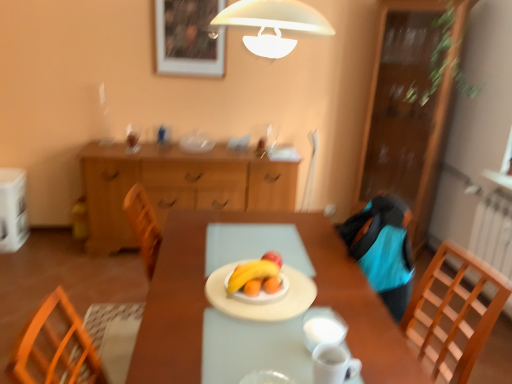
Image resolution: width=512 pixels, height=384 pixels. Identify the location of wooden cabinet at right, acting as the 2th cabinetry starting from the left. (413, 104).

Describe the element at coordinates (273, 257) in the screenshot. The height and width of the screenshot is (384, 512). I see `shiny red apple at center` at that location.

What do you see at coordinates (266, 378) in the screenshot? I see `white glossy cup at center, the 4th tableware viewed from the back` at bounding box center [266, 378].

You are a GUI agent. You are given a task and a screenshot of the screen. Output one action in this format:
    pyautogui.click(x=<x>, y=<y>)
    Task: Click on the white glossy cup at center, the 4th tableware viewed from the back
    
    Given the screenshot: What is the action you would take?
    pyautogui.click(x=266, y=378)

The width and height of the screenshot is (512, 384). Find the location of `white fabric armchair at upper center`. white fabric armchair at upper center is located at coordinates click(310, 173).

I want to click on light wood cabinet at center, marked as the first cabinetry in a left-to-right arrangement, so click(177, 186).

Where is `wooden table at center`? This screenshot has height=384, width=512. wooden table at center is located at coordinates (208, 303).

Find the location of a particular element. white glossy mug at center, which ranks as the 3th tableware in front-to-back order is located at coordinates (323, 331).

Which of these two, white fabric armchair at upper center or wooden picture frame at upper center, is bigger?

wooden picture frame at upper center.

From the picture: Does white fabric armchair at upper center turn towards wooden picture frame at upper center?

No, white fabric armchair at upper center is not facing towards wooden picture frame at upper center.

Looking at this image, is white fabric armchair at upper center positioned far away from wooden picture frame at upper center?

Indeed, white fabric armchair at upper center is not near wooden picture frame at upper center.

Is white fabric armchair at upper center completely or partially outside of wooden picture frame at upper center?

Yes, white fabric armchair at upper center is located beyond the bounds of wooden picture frame at upper center.

How distant is wooden table at center from wooden picture frame at upper center?

6.16 feet.

Between wooden table at center and wooden picture frame at upper center, which one appears on the left side from the viewer's perspective?

wooden picture frame at upper center is more to the left.

Is wooden table at center wider or thinner than wooden picture frame at upper center?

Clearly, wooden table at center has more width compared to wooden picture frame at upper center.

Is point (318, 226) farther from camera compared to point (169, 40)?

No.

From the picture: Which is more to the left, light wood cabinet at center, which is the second cabinetry from right to left, or white matte plate at center, positioned as the 1th tableware in back-to-front order?

light wood cabinet at center, which is the second cabinetry from right to left.

Does light wood cabinet at center, marked as the first cabinetry in a left-to-right arrangement, have a greater width compared to white matte plate at center, which is the fourth tableware in front-to-back order?

Yes.

From the picture: What's the angular difference between light wood cabinet at center, marked as the first cabinetry in a left-to-right arrangement, and white matte plate at center, which is the fourth tableware in front-to-back order,'s facing directions?

90.8 degrees separate the facing orientations of light wood cabinet at center, marked as the first cabinetry in a left-to-right arrangement, and white matte plate at center, which is the fourth tableware in front-to-back order.

Is there a large distance between light wood cabinet at center, which is the second cabinetry from right to left, and white matte plate at center, which is the fourth tableware in front-to-back order?

That's right, there is a large distance between light wood cabinet at center, which is the second cabinetry from right to left, and white matte plate at center, which is the fourth tableware in front-to-back order.

From a real-world perspective, is white glossy cup at center, which is counted as the first tableware, starting from the front, physically below white matte plate at center, positioned as the 1th tableware in back-to-front order?

Incorrect, from a real-world perspective, white glossy cup at center, which is counted as the first tableware, starting from the front, is higher than white matte plate at center, positioned as the 1th tableware in back-to-front order.

Can you confirm if white glossy cup at center, the 4th tableware viewed from the back, is taller than white matte plate at center, positioned as the 1th tableware in back-to-front order?

Yes, white glossy cup at center, the 4th tableware viewed from the back, is taller than white matte plate at center, positioned as the 1th tableware in back-to-front order.

Between white glossy cup at center, the 4th tableware viewed from the back, and white matte plate at center, which is the fourth tableware in front-to-back order, which one appears on the right side from the viewer's perspective?

Positioned to the right is white glossy cup at center, the 4th tableware viewed from the back.

Is there a large distance between white glossy cup at center, the 4th tableware viewed from the back, and white matte plate at center, positioned as the 1th tableware in back-to-front order?

Actually, white glossy cup at center, the 4th tableware viewed from the back, and white matte plate at center, positioned as the 1th tableware in back-to-front order, are a little close together.

Considering the sizes of objects light wood cabinet at center, which is the second cabinetry from right to left, and wooden picture frame at upper center in the image provided, who is taller, light wood cabinet at center, which is the second cabinetry from right to left, or wooden picture frame at upper center?

light wood cabinet at center, which is the second cabinetry from right to left, is taller.

Considering the relative positions of light wood cabinet at center, which is the second cabinetry from right to left, and wooden picture frame at upper center in the image provided, is light wood cabinet at center, which is the second cabinetry from right to left, to the left of wooden picture frame at upper center from the viewer's perspective?

Correct, you'll find light wood cabinet at center, which is the second cabinetry from right to left, to the left of wooden picture frame at upper center.

Is wooden picture frame at upper center at the back of light wood cabinet at center, marked as the first cabinetry in a left-to-right arrangement?

No, wooden picture frame at upper center is not at the back of light wood cabinet at center, marked as the first cabinetry in a left-to-right arrangement.

How much distance is there between light wood cabinet at center, marked as the first cabinetry in a left-to-right arrangement, and wooden picture frame at upper center?

The distance of light wood cabinet at center, marked as the first cabinetry in a left-to-right arrangement, from wooden picture frame at upper center is 34.11 inches.

Is white glossy mug at lower center, which is the 2th tableware from front to back, oriented away from wooden cabinet at right, acting as the 2th cabinetry starting from the left?

white glossy mug at lower center, which is the 2th tableware from front to back, is not turned away from wooden cabinet at right, acting as the 2th cabinetry starting from the left.

From the image's perspective, who appears lower, white glossy mug at lower center, which is the 2th tableware from front to back, or wooden cabinet at right, which is the 1th cabinetry from right to left?

white glossy mug at lower center, which is the 2th tableware from front to back, is shown below in the image.

Which point is more distant from viewer, (327,375) or (400,32)?

Point (400,32)

Considering the relative sizes of white glossy mug at lower center, the 3th tableware viewed from the back, and wooden cabinet at right, acting as the 2th cabinetry starting from the left, in the image provided, is white glossy mug at lower center, the 3th tableware viewed from the back, bigger than wooden cabinet at right, acting as the 2th cabinetry starting from the left,?

No, white glossy mug at lower center, the 3th tableware viewed from the back, is not bigger than wooden cabinet at right, acting as the 2th cabinetry starting from the left.

Which object is closer to the camera taking this photo, light wood cabinet at center, which is the second cabinetry from right to left, or wooden cabinet at right, which is the 1th cabinetry from right to left?

wooden cabinet at right, which is the 1th cabinetry from right to left, is in front.

Which of these two, light wood cabinet at center, marked as the first cabinetry in a left-to-right arrangement, or wooden cabinet at right, acting as the 2th cabinetry starting from the left, is smaller?

wooden cabinet at right, acting as the 2th cabinetry starting from the left, is smaller.

Does light wood cabinet at center, marked as the first cabinetry in a left-to-right arrangement, turn towards wooden cabinet at right, which is the 1th cabinetry from right to left?

No, light wood cabinet at center, marked as the first cabinetry in a left-to-right arrangement, is not oriented towards wooden cabinet at right, which is the 1th cabinetry from right to left.

Is light wood cabinet at center, marked as the first cabinetry in a left-to-right arrangement, to the left or to the right of wooden cabinet at right, acting as the 2th cabinetry starting from the left, in the image?

Clearly, light wood cabinet at center, marked as the first cabinetry in a left-to-right arrangement, is on the left of wooden cabinet at right, acting as the 2th cabinetry starting from the left, in the image.

This screenshot has width=512, height=384. What are the coordinates of `picture frame located on the left of white fabric armchair at upper center` in the screenshot? It's located at (188, 38).

The width and height of the screenshot is (512, 384). What are the coordinates of `desk in front of the wooden picture frame at upper center` in the screenshot? It's located at (208, 303).

Which object lies further to the anchor point shiny red apple at center, wooden cabinet at right, acting as the 2th cabinetry starting from the left, or white glossy cup at center, the 4th tableware viewed from the back?

Based on the image, wooden cabinet at right, acting as the 2th cabinetry starting from the left, appears to be further to shiny red apple at center.

Looking at the image, which one is located closer to white glossy mug at center, which is counted as the second tableware, starting from the back, wooden table at center or white matte plate at center, which is the fourth tableware in front-to-back order?

Among the two, white matte plate at center, which is the fourth tableware in front-to-back order, is located nearer to white glossy mug at center, which is counted as the second tableware, starting from the back.

Looking at the image, which one is located further to wooden picture frame at upper center, white glossy mug at lower center, the 3th tableware viewed from the back, or white matte plate at center, which is the fourth tableware in front-to-back order?

white glossy mug at lower center, the 3th tableware viewed from the back.

Considering their positions, is white glossy cup at center, the 4th tableware viewed from the back, positioned closer to white matte plate at center, positioned as the 1th tableware in back-to-front order, than light wood cabinet at center, marked as the first cabinetry in a left-to-right arrangement?

Among the two, white glossy cup at center, the 4th tableware viewed from the back, is located nearer to white matte plate at center, positioned as the 1th tableware in back-to-front order.

Looking at the image, which one is located closer to wooden picture frame at upper center, white fabric armchair at upper center or light wood cabinet at center, which is the second cabinetry from right to left?

light wood cabinet at center, which is the second cabinetry from right to left, is positioned closer to the anchor wooden picture frame at upper center.

Estimate the real-world distances between objects in this image. Which object is closer to wooden cabinet at right, which is the 1th cabinetry from right to left, shiny red apple at center or white glossy cup at center, the 4th tableware viewed from the back?

Based on the image, shiny red apple at center appears to be nearer to wooden cabinet at right, which is the 1th cabinetry from right to left.

Based on their spatial positions, is wooden table at center or white glossy mug at center, which ranks as the 3th tableware in front-to-back order, further from white fabric armchair at upper center?

Answer: Based on the image, white glossy mug at center, which ranks as the 3th tableware in front-to-back order, appears to be further to white fabric armchair at upper center.

Considering their positions, is yellow matte banana at center positioned closer to white glossy mug at lower center, which is the 2th tableware from front to back, than white glossy mug at center, which is counted as the second tableware, starting from the back?

white glossy mug at center, which is counted as the second tableware, starting from the back, is positioned closer to the anchor white glossy mug at lower center, which is the 2th tableware from front to back.

Identify the location of chair positioned between wooden table at center and light wood cabinet at center, which is the second cabinetry from right to left, from near to far. (452, 315).

Find the location of a particular element. chair between white glossy mug at lower center, which is the 2th tableware from front to back, and white fabric armchair at upper center, along the z-axis is located at coordinates point(452,315).

In order to click on fruit between white plastic bag at left and white fabric armchair at upper center in this screenshot , I will do `click(273, 257)`.

Image resolution: width=512 pixels, height=384 pixels. Find the location of `armchair between light wood cabinet at center, marked as the first cabinetry in a left-to-right arrangement, and wooden cabinet at right, acting as the 2th cabinetry starting from the left, from left to right`. armchair between light wood cabinet at center, marked as the first cabinetry in a left-to-right arrangement, and wooden cabinet at right, acting as the 2th cabinetry starting from the left, from left to right is located at coordinates (310, 173).